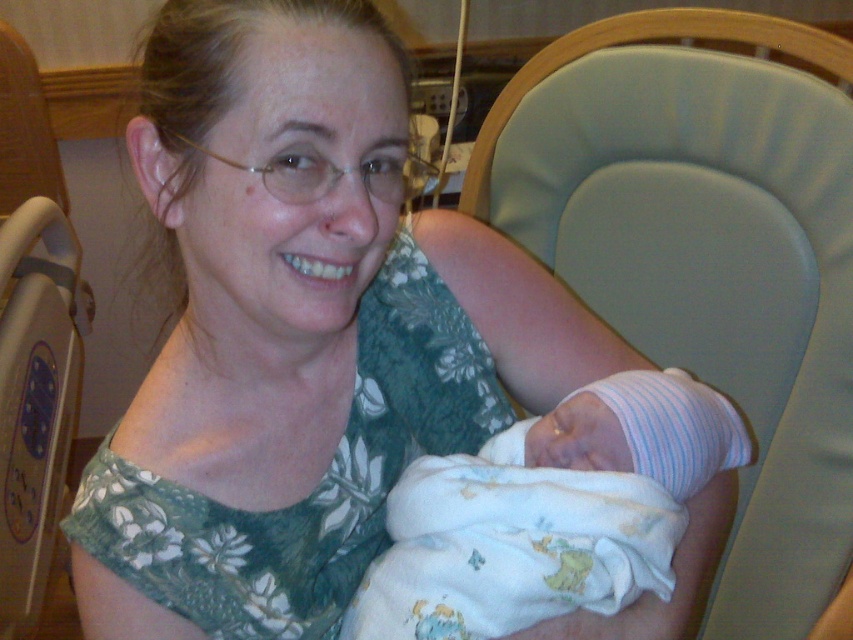
The width and height of the screenshot is (853, 640). What do you see at coordinates (706, 252) in the screenshot?
I see `light green fabric chair at center` at bounding box center [706, 252].

From the picture: Is light green fabric chair at center below white soft swaddled newborn at center?

Incorrect, light green fabric chair at center is not positioned below white soft swaddled newborn at center.

Who is more distant from viewer, [483,147] or [418,563]?

Positioned behind is point [483,147].

The width and height of the screenshot is (853, 640). What are the coordinates of `light green fabric chair at center` in the screenshot? It's located at (706, 252).